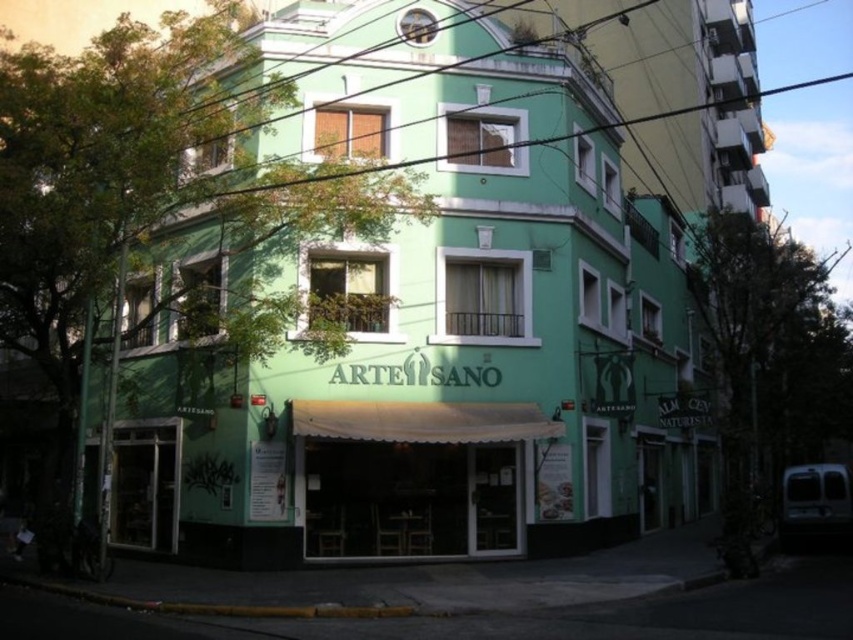
Between green matte building at center and white fabric awning at center, which one has less height?

With less height is white fabric awning at center.

Is point (393, 362) positioned before point (518, 404)?

Yes, point (393, 362) is in front of point (518, 404).

Locate an element on the screen. green matte building at center is located at coordinates (451, 307).